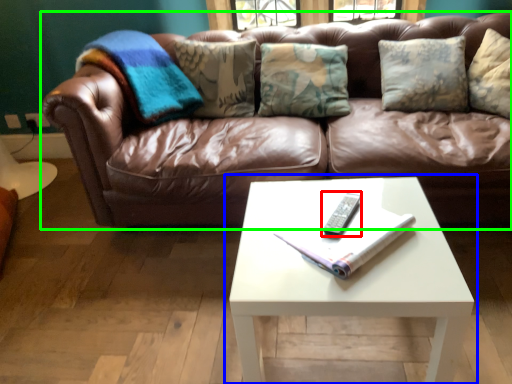
Question: Based on their relative distances, which object is nearer to remote (highlighted by a red box)? Choose from coffee table (highlighted by a blue box) and studio couch (highlighted by a green box).

Choices:
 (A) coffee table
 (B) studio couch

Answer: (A)